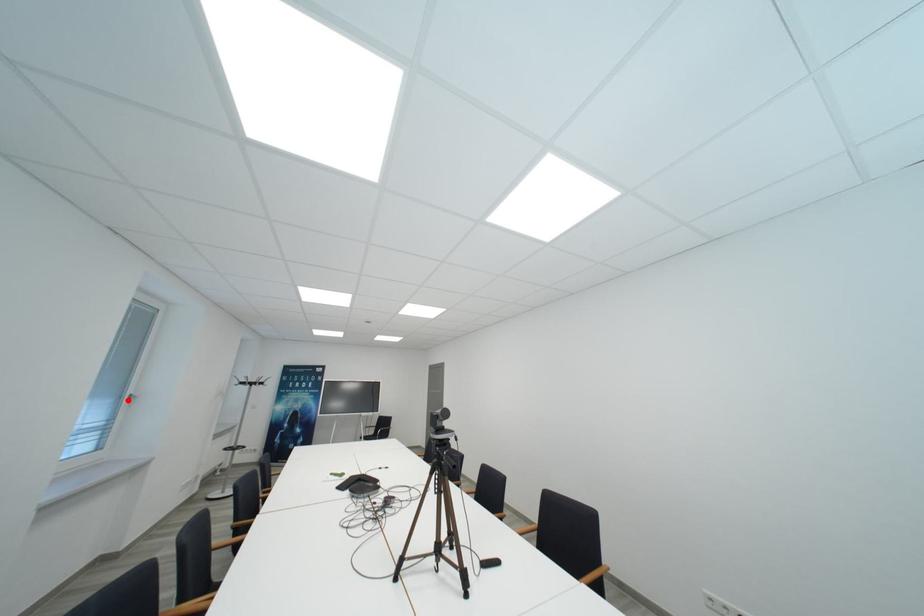
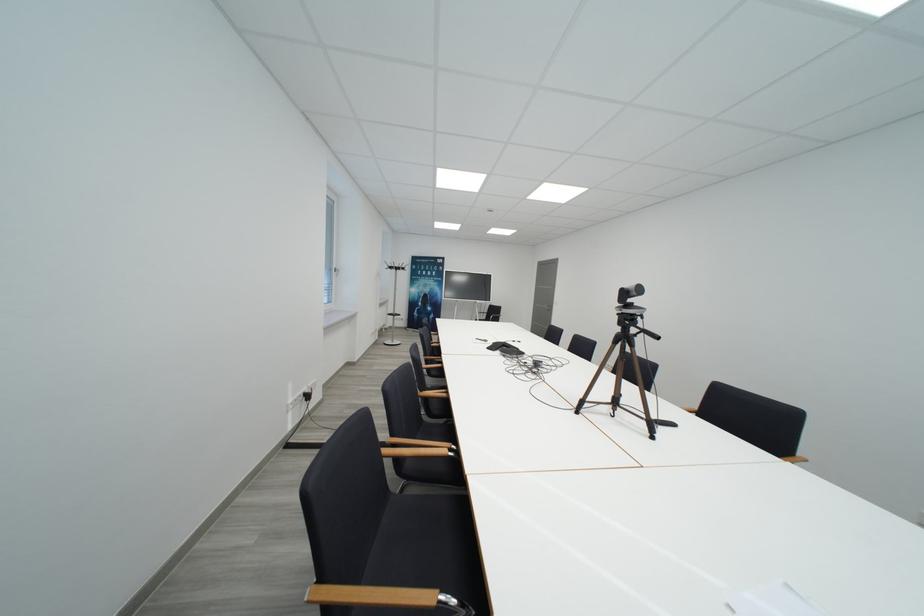
The point at the highlighted location is marked in the first image. Where is the corresponding point in the second image?

(337, 273)